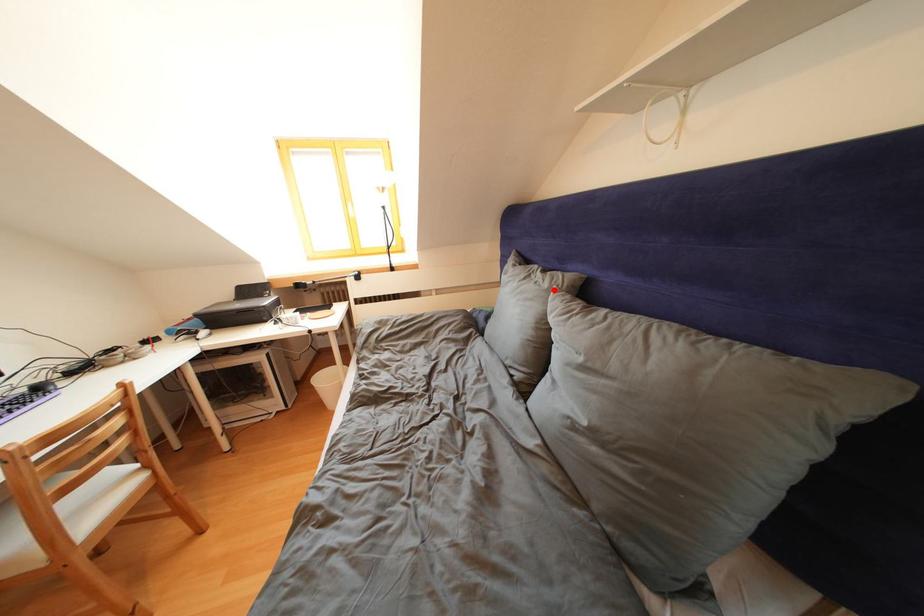
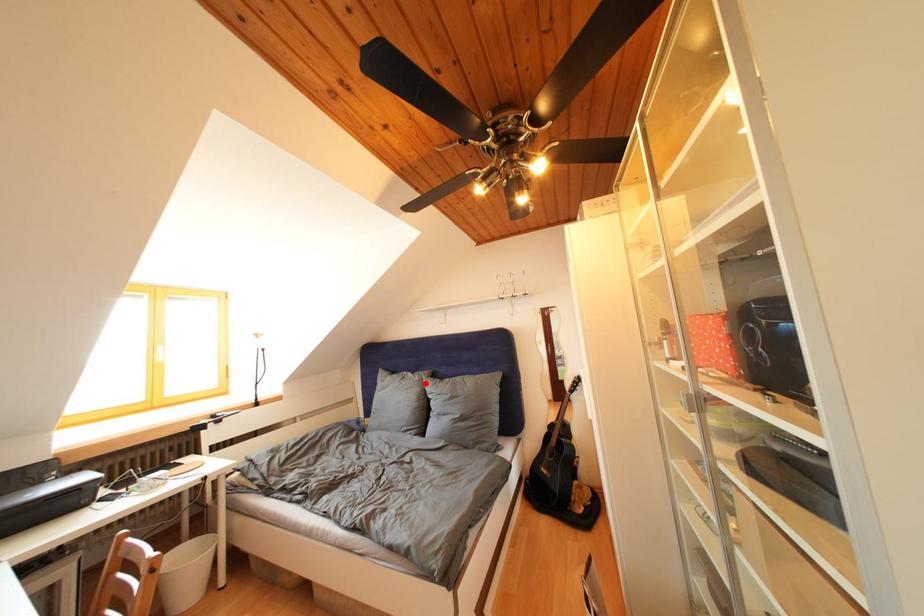
I am providing you with two images of the same scene from different viewpoints. A red point is marked on the first image and another point is marked on the second image. Is the marked point in image1 the same physical position as the marked point in image2?

Yes